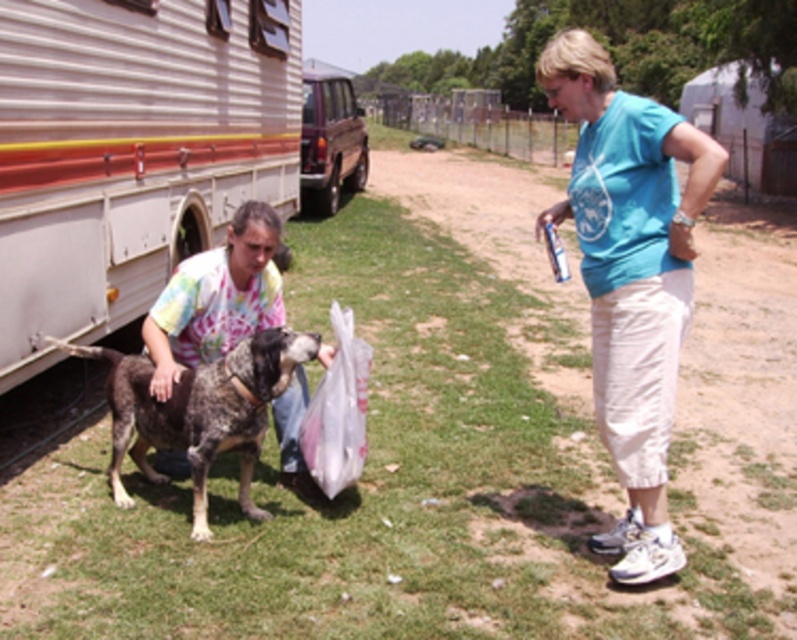
You are standing at the point labeled point (79, 349) and want to move to the point labeled point (360, 116). Which direction should you move in to get closer to the second point?

To move from point (79, 349) to point (360, 116), you should move upwards and to the left since point (79, 349) is closer to the viewer than point (360, 116).

You are standing at the point labeled point (328, 145) and want to walk to the point labeled point (635, 346). Which direction should you move in to reach your destination?

To reach point (635, 346) from point (328, 145), you should move forward since point (635, 346) is in front of point (328, 145).